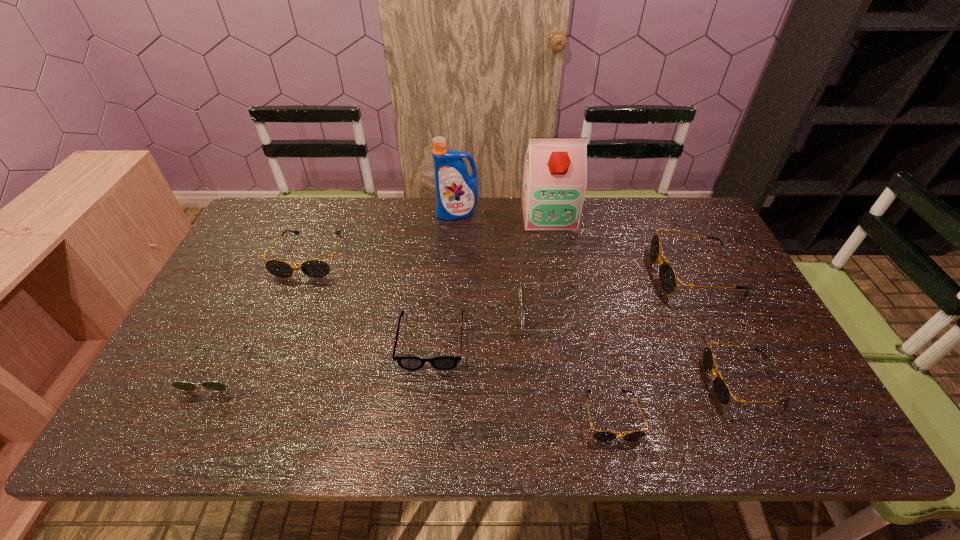
Where is `sunglasses object that ranks as the sixth closest to the black spectacles`? This screenshot has height=540, width=960. sunglasses object that ranks as the sixth closest to the black spectacles is located at coordinates (721, 390).

Locate which black sunglasses ranks third in proximity to the third biggest black sunglasses. Please provide its 2D coordinates. Your answer should be formatted as a tuple, i.e. [(x, y)], where the tuple contains the x and y coordinates of a point satisfying the conditions above.

[(315, 268)]

You are a GUI agent. You are given a task and a screenshot of the screen. Output one action in this format:
    pyautogui.click(x=<x>, y=<y>)
    Task: Click on the second closest black sunglasses relative to the third tallest object
    The image size is (960, 540).
    Given the screenshot: What is the action you would take?
    pyautogui.click(x=599, y=435)

Locate an element on the screen. vacant region that satisfies the following two spatial constraints: 1. on the front-facing side of the second smallest black sunglasses; 2. on the front-facing side of the third black sunglasses from right to left is located at coordinates click(x=759, y=416).

Find the location of a particular element. The width and height of the screenshot is (960, 540). free space that satisfies the following two spatial constraints: 1. on the front-facing side of the tallest sunglasses; 2. on the front-facing side of the second black sunglasses from left to right is located at coordinates (766, 416).

At what (x,y) coordinates should I click in order to perform the action: click on vacant position in the image that satisfies the following two spatial constraints: 1. on the front-facing side of the farther green sunglasses; 2. on the front-facing side of the left green sunglasses. Please return your answer as a coordinate pair (x, y). This screenshot has width=960, height=540. Looking at the image, I should click on (558, 369).